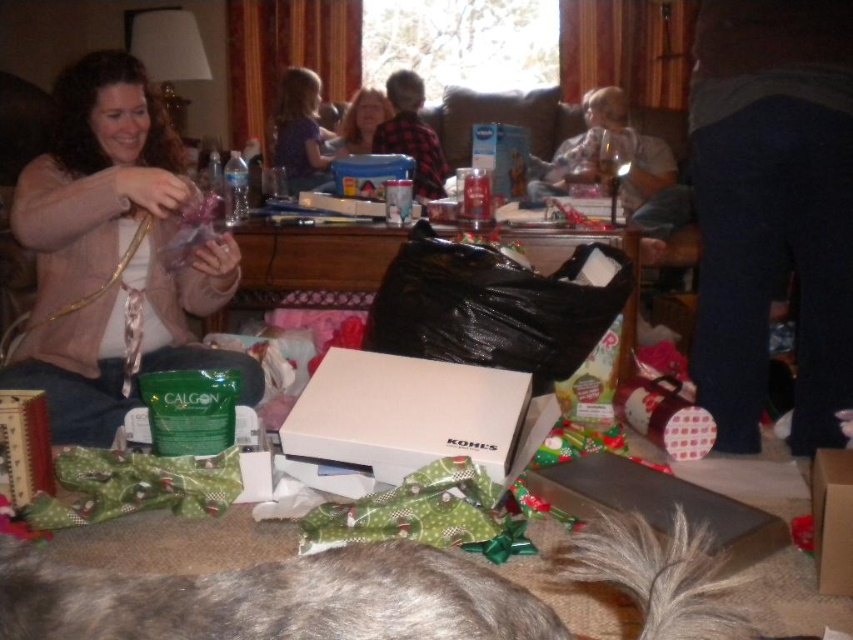
You are a guest at the holiday gathering and want to find the purple dotted shirt at upper center. Since you can only see the fuzzy fur tail at lower center, which object is closer to you?

The fuzzy fur tail at lower center is closer to you because it is shorter than the purple dotted shirt at upper center.